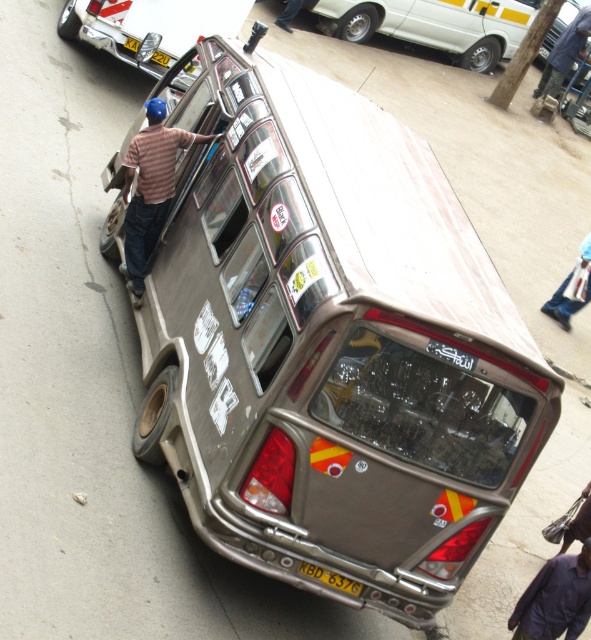
You are a delivery driver who needs to park the metallic silver van at center in a parking spot that is exactly the width of the yellow metallic license plate at bottom center. Can you fit the van into the parking spot?

The metallic silver van at center is wider than the yellow metallic license plate at bottom center, so it cannot fit into a parking spot that is exactly the width of the license plate.

You are a delivery driver who needs to park your vehicle in a tight space between the metallic silver car at upper left and the blue helmet at upper left. Given that your vehicle is 4 meters long, can you fit your vehicle between them?

The metallic silver car at upper left is larger in size than the blue helmet at upper left, but the description does not provide the exact distance between them. Therefore, it is impossible to determine if the 4 meter long vehicle can fit between them.

You are a delivery driver who needs to park your metallic silver van at center in a spot that requires the license plate to be visible. Based on the scene, can you park the van so that the yellow metallic license plate at bottom center is visible from the front?

The metallic silver van at center is positioned on the left side of the yellow metallic license plate at bottom center, so if you park the van so that the license plate is on the right side, it should be visible from the front.